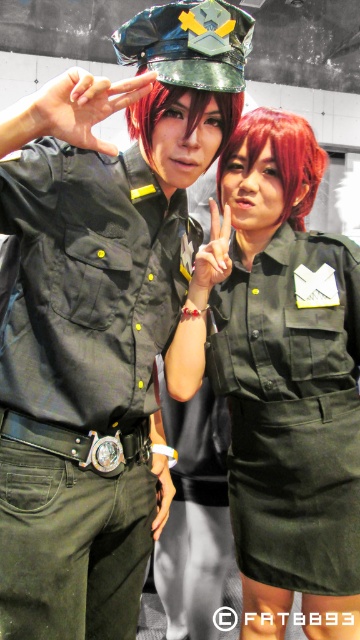
Question: Which object appears farthest from the camera in this image?

Choices:
 (A) matte black shirt at left
 (B) shiny red wig at center
 (C) matte green uniform at center

Answer: (C)

Question: Which point appears farthest from the camera in this image?

Choices:
 (A) click(x=191, y=116)
 (B) click(x=218, y=192)
 (C) click(x=59, y=336)

Answer: (B)

Question: Can you confirm if matte black shirt at left is positioned below matte green uniform at center?

Choices:
 (A) yes
 (B) no

Answer: (A)

Question: Which object appears farthest from the camera in this image?

Choices:
 (A) shiny red hair at center
 (B) matte black shirt at left

Answer: (B)

Question: Is matte black shirt at left to the right of shiny red wig at center from the viewer's perspective?

Choices:
 (A) no
 (B) yes

Answer: (A)

Question: Observing the image, what is the correct spatial positioning of matte green uniform at center in reference to shiny red hair at center?

Choices:
 (A) left
 (B) right

Answer: (B)